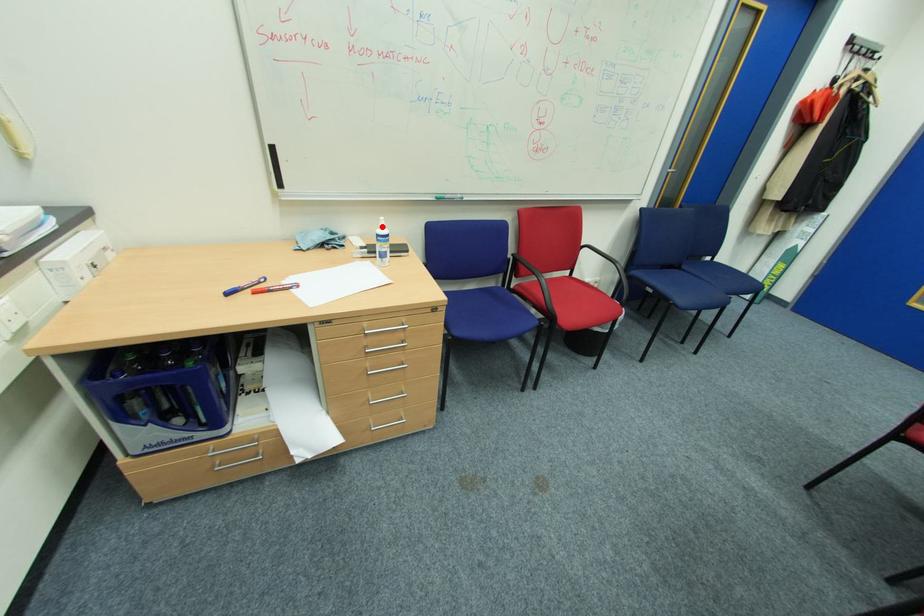
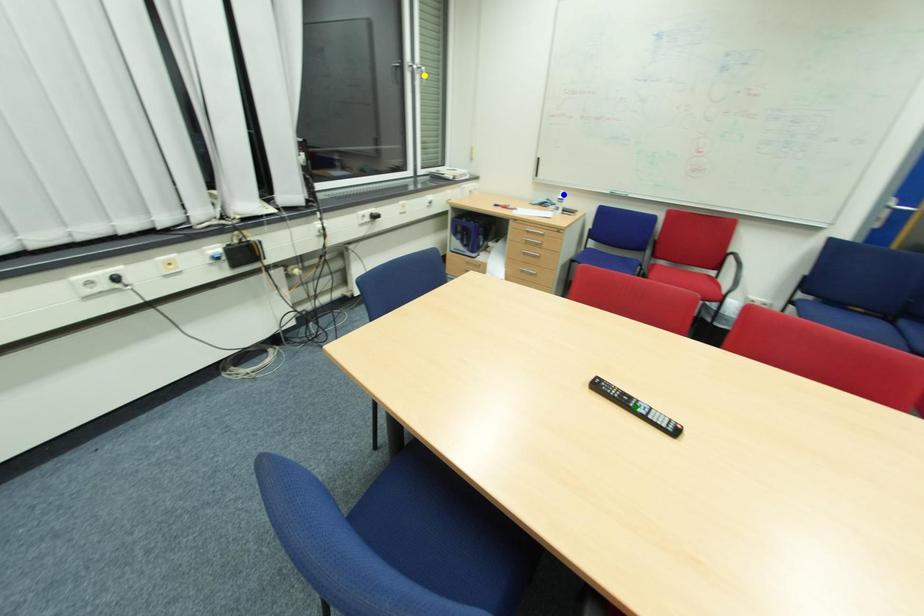
Question: I am providing you with two images of the same scene from different viewpoints. A red point is marked on the first image. You are given multiple points on the second image. Can you choose the point in image 2 that corresponds to the point in image 1?

Choices:
 (A) blue point
 (B) green point
 (C) yellow point

Answer: (A)